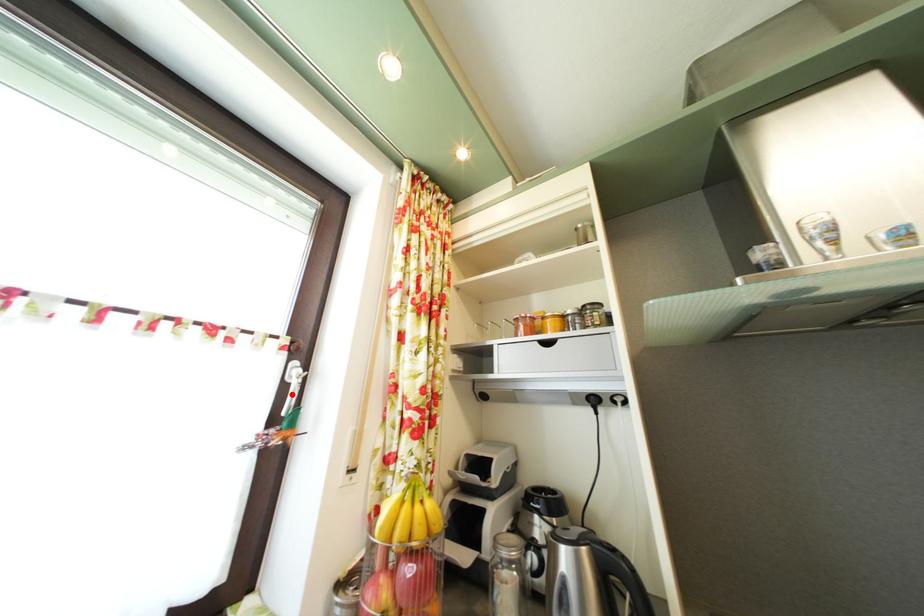
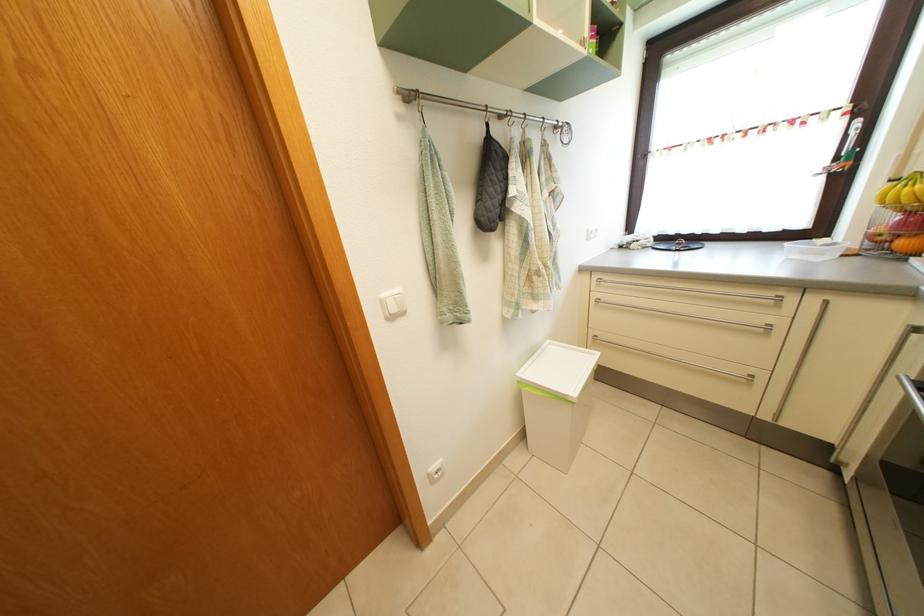
The point at the highlighted location is marked in the first image. Where is the corresponding point in the second image?

(853, 146)